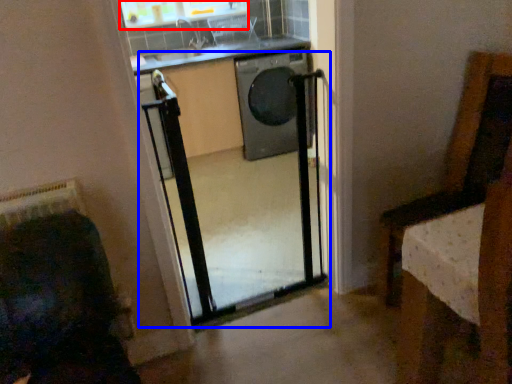
Question: Which object appears closest to the camera in this image, window (highlighted by a red box) or screen door (highlighted by a blue box)?

Choices:
 (A) window
 (B) screen door

Answer: (B)